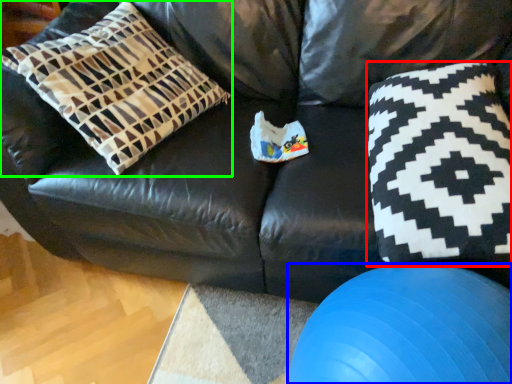
Question: Which object is the closest to the throw pillow (highlighted by a red box)? Choose among these: ball (highlighted by a blue box) or pillow (highlighted by a green box).

Choices:
 (A) ball
 (B) pillow

Answer: (A)